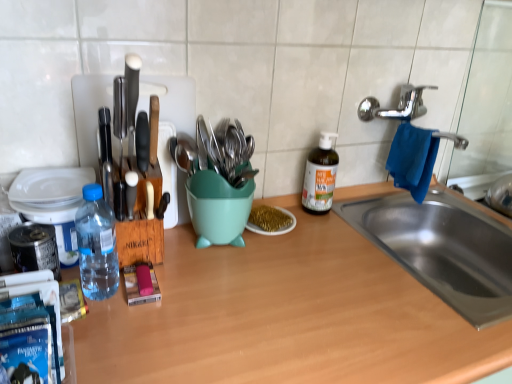
Find the location of `vacant space to the right of gold glitter plate at center`. vacant space to the right of gold glitter plate at center is located at coordinates (345, 243).